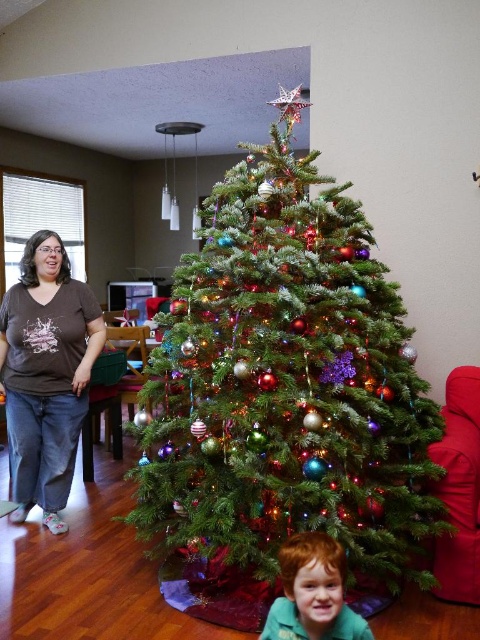
Can you confirm if green matte christmas tree at center is shorter than brown cotton shirt at left?

Incorrect, green matte christmas tree at center's height does not fall short of brown cotton shirt at left's.

Between point (334, 237) and point (13, 316), which one is positioned in front?

Point (334, 237) is in front.

Who is more distant from viewer, (274,202) or (0,332)?

The point (0,332) is behind.

I want to click on green matte christmas tree at center, so click(287, 381).

Is point (61, 332) farther from camera compared to point (324, 536)?

Yes, it is behind point (324, 536).

Between brown cotton shirt at left and reddish-brown hair boy at lower center, which one is positioned lower?

reddish-brown hair boy at lower center is below.

Is point (21, 289) closer to viewer compared to point (328, 596)?

No, it is behind (328, 596).

Locate an element on the screen. brown cotton shirt at left is located at coordinates (46, 376).

Does green matte christmas tree at center have a larger size compared to reddish-brown hair boy at lower center?

Yes.

Which of these two, green matte christmas tree at center or reddish-brown hair boy at lower center, stands taller?

green matte christmas tree at center

Which is in front, point (325, 529) or point (312, 547)?

Positioned in front is point (312, 547).

Identify the location of green matte christmas tree at center. (287, 381).